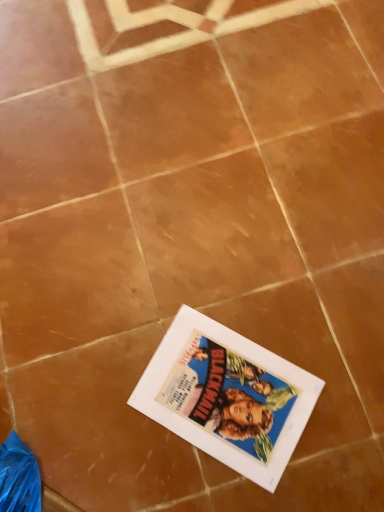
Where is `matte paper book cover at center`? matte paper book cover at center is located at coordinates (227, 396).

Measure the distance between matte paper book cover at center and camera.

matte paper book cover at center is 28.75 inches away from camera.

The width and height of the screenshot is (384, 512). Describe the element at coordinates (227, 396) in the screenshot. I see `matte paper book cover at center` at that location.

Locate an element on the screen. matte paper book cover at center is located at coordinates (227, 396).